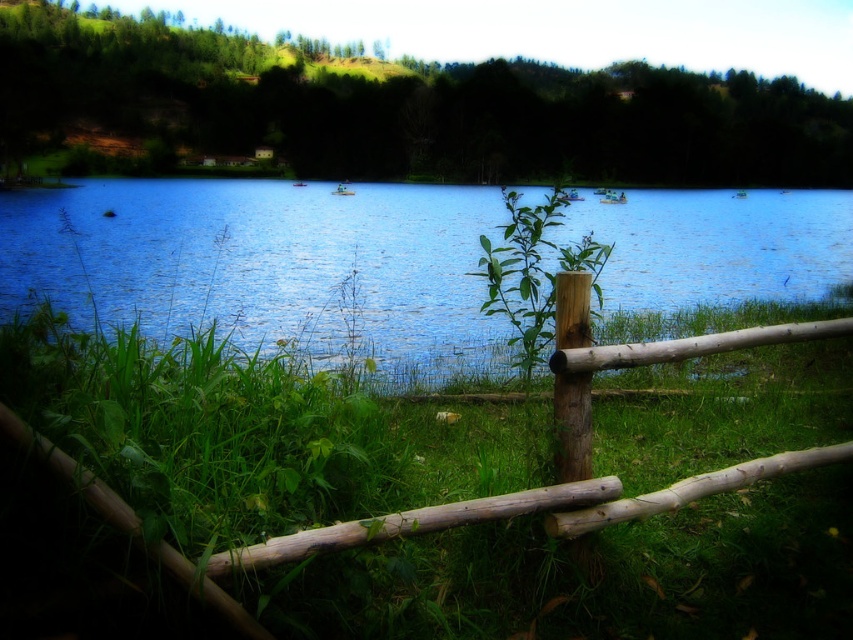
Does point (364, 593) come behind point (461, 314)?

That is False.

Who is positioned more to the right, green rough grass at lower center or blue water at center?

blue water at center

Find the location of a particular element. This screenshot has width=853, height=640. green rough grass at lower center is located at coordinates (251, 435).

Between point (413, 250) and point (554, 276), which one is positioned behind?

Point (413, 250)

Does blue water at center have a greater height compared to green leafy plant at center?

Yes, blue water at center is taller than green leafy plant at center.

Locate an element on the screen. Image resolution: width=853 pixels, height=640 pixels. blue water at center is located at coordinates (267, 266).

Identify the location of blue water at center. This screenshot has height=640, width=853. (267, 266).

Between green rough grass at lower center and green leafy plant at center, which one is positioned lower?

green rough grass at lower center is lower down.

Does green rough grass at lower center appear on the right side of green leafy plant at center?

In fact, green rough grass at lower center is to the left of green leafy plant at center.

Who is more distant from viewer, (x=364, y=598) or (x=549, y=330)?

The point (x=549, y=330) is more distant.

The image size is (853, 640). In order to click on green rough grass at lower center in this screenshot , I will do `click(251, 435)`.